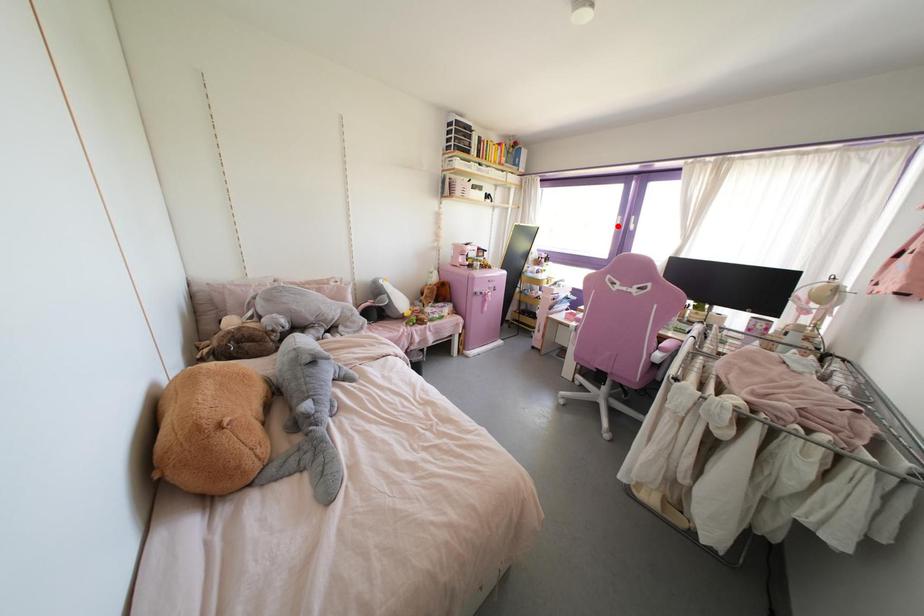
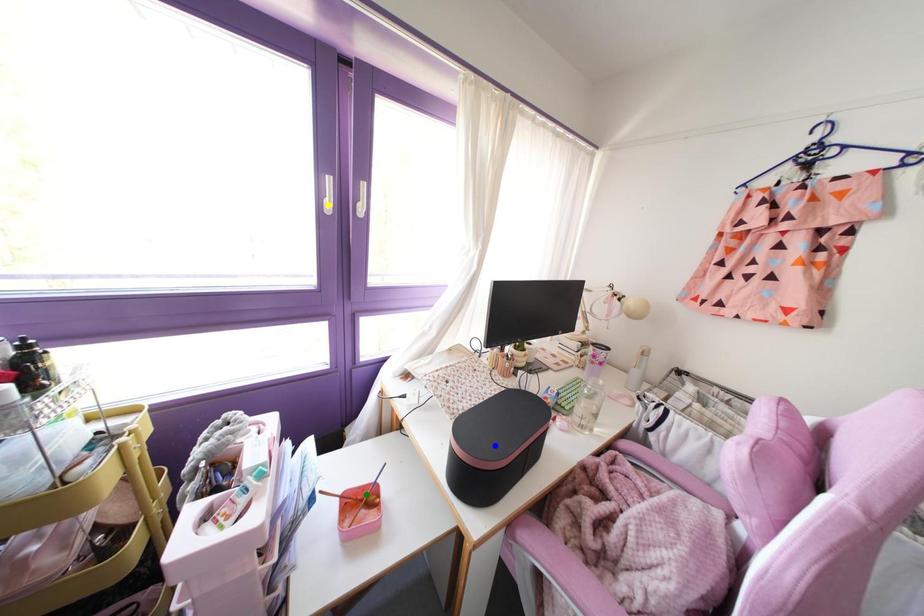
Question: I am providing you with two images of the same scene from different viewpoints. A red point is marked on the first image. You are given multiple points on the second image. Which spot in image 2 lines up with the point in image 1?

Choices:
 (A) blue point
 (B) green point
 (C) yellow point

Answer: (C)